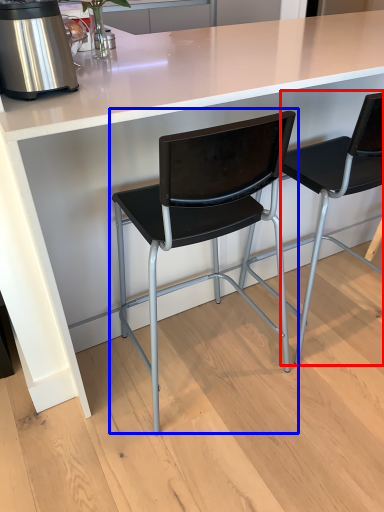
Question: Which of the following is the closest to the observer, chair (highlighted by a red box) or chair (highlighted by a blue box)?

Choices:
 (A) chair
 (B) chair

Answer: (B)